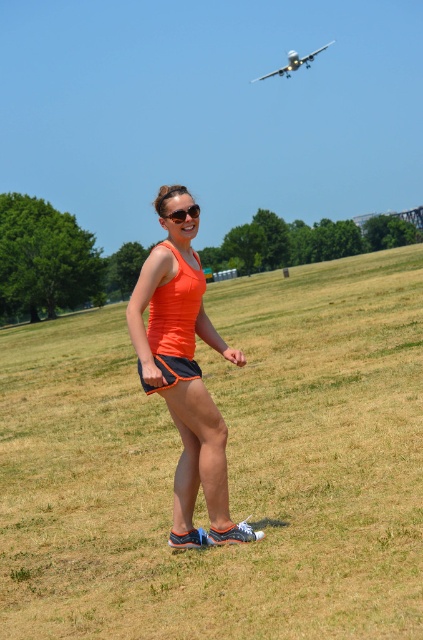
You are a photographer trying to capture the person in the orange fabric tank top at center and the white matte airplane at upper center in the same frame. Which object is positioned closer to the camera?

The orange fabric tank top at center is closer to the viewer than the white matte airplane at upper center, so the tank top is closer to the camera.

You are a photographer trying to capture a photo of the white matte airplane at upper center without any obstructions. However, there are matte black sunglasses at center in the way. Based on their positions, can you still take the photo without the sunglasses blocking the airplane?

The matte black sunglasses at center are positioned behind the white matte airplane at upper center, so they won not block the view of the airplane. You can take the photo without any obstruction.